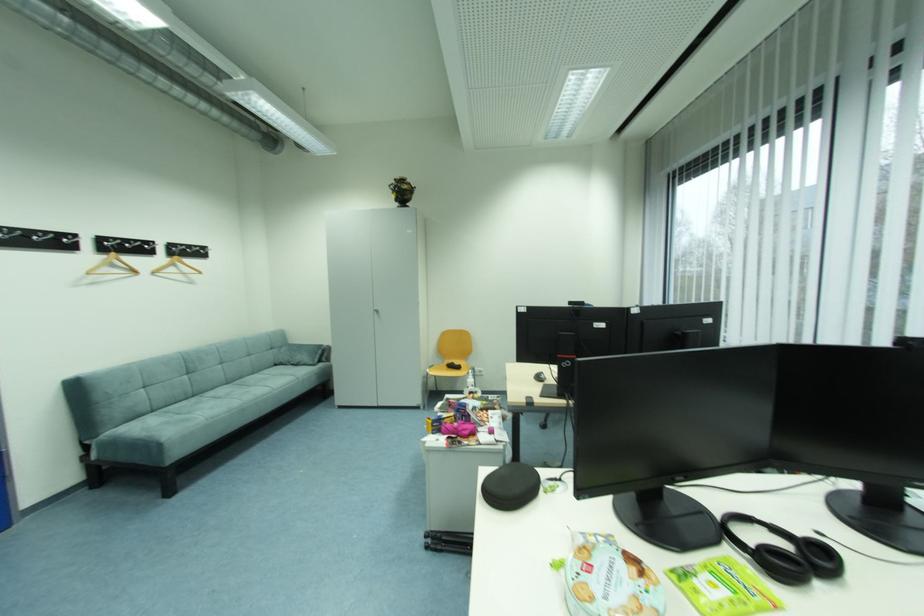
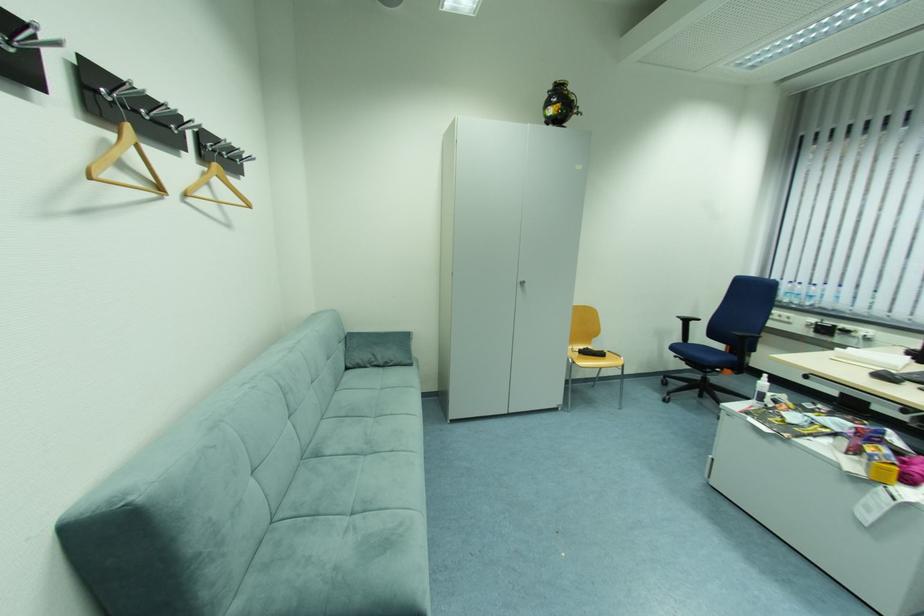
Find the pixel in the second image that matches point 466,369 in the first image.

(608, 355)